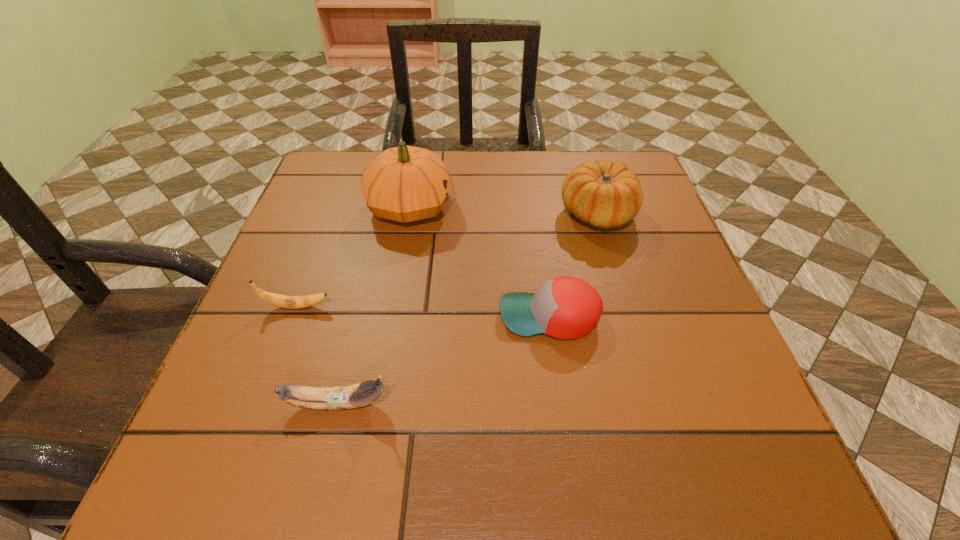
This screenshot has height=540, width=960. I want to click on vacant space that satisfies the following two spatial constraints: 1. on the side of the right gourd with the carved face; 2. on the left side of the left gourd, so click(x=409, y=214).